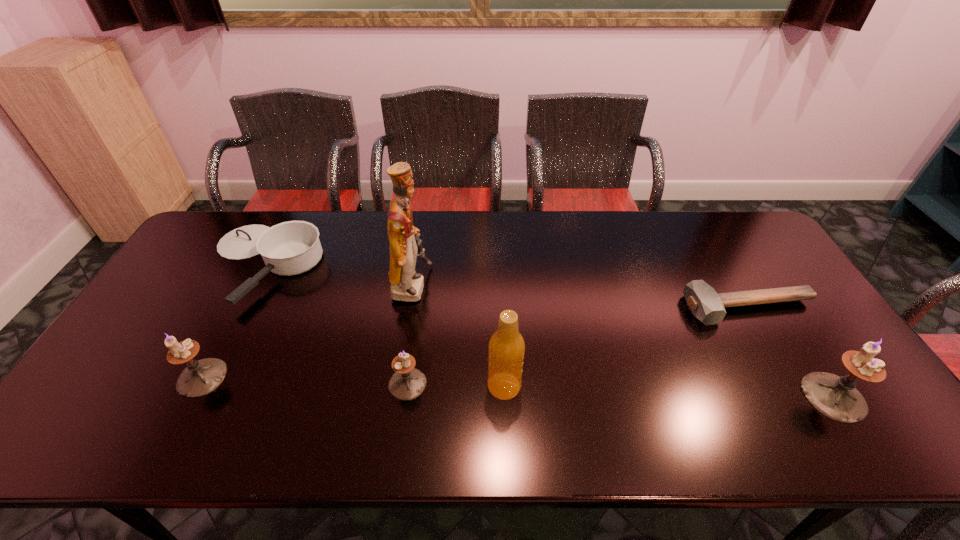
Locate an element on the screen. Image resolution: width=960 pixels, height=540 pixels. free area in between the shortest candle holder and the nutcracker is located at coordinates (410, 335).

The height and width of the screenshot is (540, 960). In order to click on vacant area between the tallest object and the fifth shortest object in this screenshot , I will do `click(623, 342)`.

You are a GUI agent. You are given a task and a screenshot of the screen. Output one action in this format:
    pyautogui.click(x=<x>, y=<y>)
    Task: Click on the free space between the fifth object from left to right and the saucepan
    
    Given the screenshot: What is the action you would take?
    pyautogui.click(x=384, y=326)

Locate an element on the screen. The height and width of the screenshot is (540, 960). unoccupied position between the fifth shortest object and the third shortest object is located at coordinates (620, 390).

This screenshot has width=960, height=540. I want to click on vacant space that's between the second candle holder from left to right and the third object from right to left, so click(456, 385).

Identify the location of empty space between the rightmost candle holder and the sixth tallest object. point(548,330).

Identify the location of free space between the shortest object and the tallest object. (581, 298).

Image resolution: width=960 pixels, height=540 pixels. Find the location of `free space between the third shortest object and the second shortest candle holder`. free space between the third shortest object and the second shortest candle holder is located at coordinates (305, 381).

Locate an element on the screen. This screenshot has height=540, width=960. free spot between the shortest candle holder and the sixth tallest object is located at coordinates (335, 324).

Select which object appears as the fourth closest to the tallest candle holder. Please provide its 2D coordinates. Your answer should be formatted as a tuple, i.e. [(x, y)], where the tuple contains the x and y coordinates of a point satisfying the conditions above.

[(406, 285)]